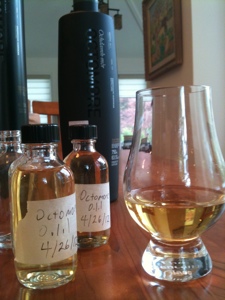
Locate an element on the screen. The width and height of the screenshot is (225, 300). table is located at coordinates tap(107, 271).